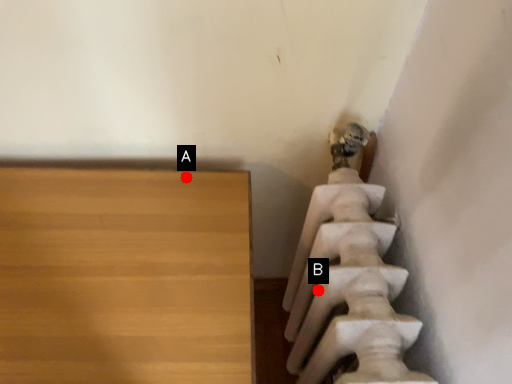
Question: Two points are circled on the image, labeled by A and B beside each circle. Which point is closer to the camera?

Choices:
 (A) A is closer
 (B) B is closer

Answer: (B)